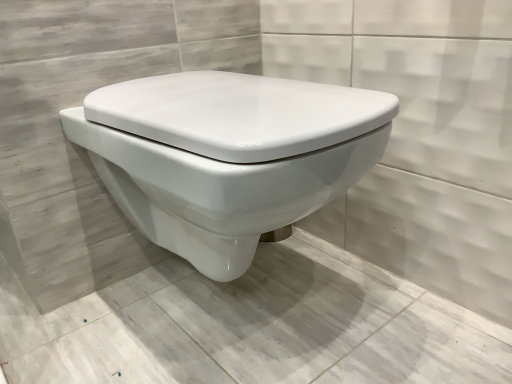
At what (x,y) coordinates should I click in order to perform the action: click on vacant space situated on the left part of white glossy toilet at center. Please return your answer as a coordinate pair (x, y). This screenshot has width=512, height=384. Looking at the image, I should click on (85, 326).